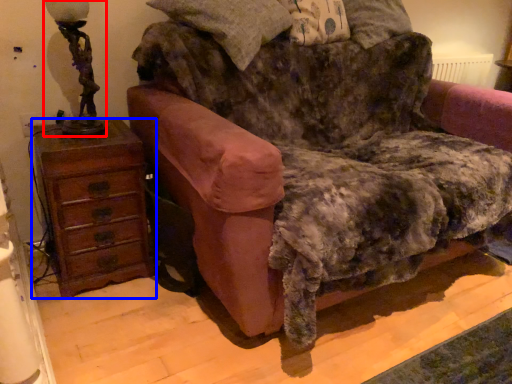
Question: Which of the following is the closest to the observer, table lamp (highlighted by a red box) or chest of drawers (highlighted by a blue box)?

Choices:
 (A) table lamp
 (B) chest of drawers

Answer: (A)